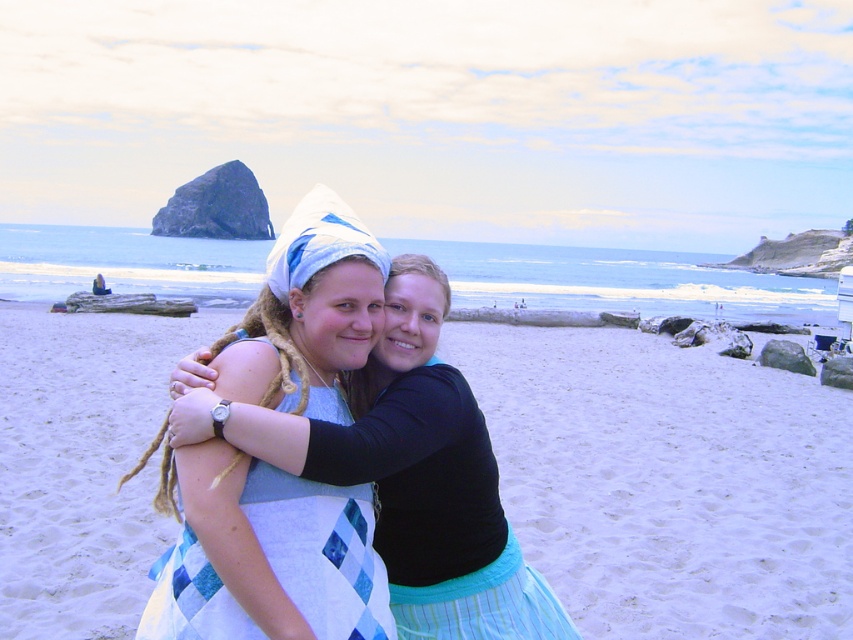
Question: Which object appears farthest from the camera in this image?

Choices:
 (A) quilted fabric dress at center
 (B) white sand at center
 (C) blue diamond-patterned fabric dress at center

Answer: (B)

Question: Where is quilted fabric dress at center located in relation to blue diamond-patterned fabric dress at center in the image?

Choices:
 (A) right
 (B) left

Answer: (A)

Question: Can you confirm if white sand at center is positioned to the right of blue diamond-patterned fabric dress at center?

Choices:
 (A) no
 (B) yes

Answer: (B)

Question: Which object is farther from the camera taking this photo?

Choices:
 (A) quilted fabric dress at center
 (B) white sand at center

Answer: (B)

Question: Which point appears farthest from the camera in this image?

Choices:
 (A) (767, 529)
 (B) (170, 556)
 (C) (384, 337)

Answer: (A)

Question: Can you confirm if quilted fabric dress at center is smaller than blue diamond-patterned fabric dress at center?

Choices:
 (A) yes
 (B) no

Answer: (B)